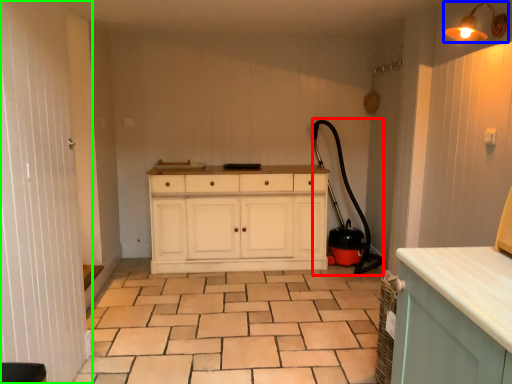
Question: Considering the real-world distances, which object is closest to garden hose (highlighted by a red box)? light fixture (highlighted by a blue box) or screen door (highlighted by a green box).

Choices:
 (A) light fixture
 (B) screen door

Answer: (A)